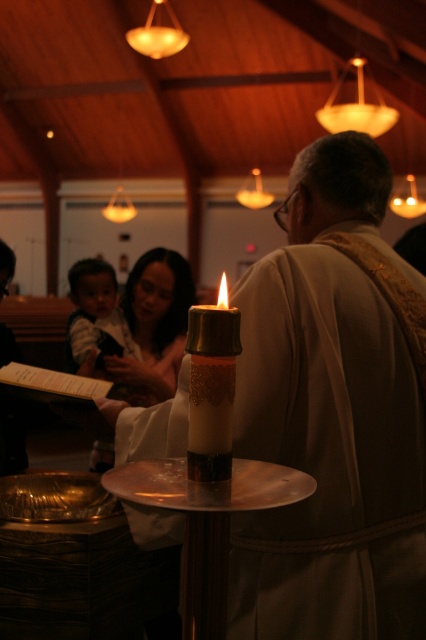
Question: Does matte gold robe at center have a greater width compared to gold glitter candle at center?

Choices:
 (A) no
 (B) yes

Answer: (B)

Question: Is matte gold robe at center further to camera compared to gold glitter candle at center?

Choices:
 (A) no
 (B) yes

Answer: (B)

Question: Does matte gold robe at center lie in front of gold glitter candle at center?

Choices:
 (A) no
 (B) yes

Answer: (A)

Question: Which object is closer to the camera taking this photo?

Choices:
 (A) gold glitter candle at center
 (B) matte gold robe at center

Answer: (A)